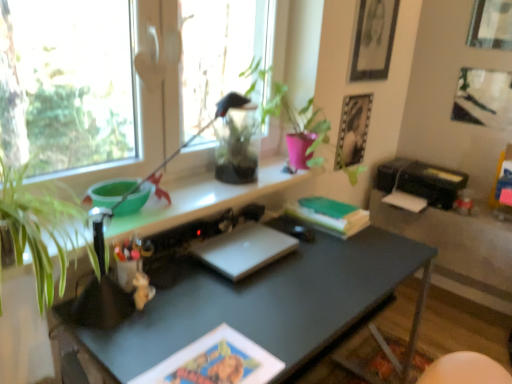
Question: Does metallic silver photo frame at upper right, placed as the 4th picture frame when sorted from right to left, turn towards matte black picture frame at upper right, acting as the 2th picture frame starting from the left?

Choices:
 (A) no
 (B) yes

Answer: (A)

Question: Is metallic silver photo frame at upper right, placed as the 4th picture frame when sorted from right to left, turned away from matte black picture frame at upper right, acting as the 2th picture frame starting from the left?

Choices:
 (A) yes
 (B) no

Answer: (B)

Question: From the image's perspective, is metallic silver photo frame at upper right, positioned as the first picture frame in left-to-right order, beneath matte black picture frame at upper right, which ranks as the third picture frame in right-to-left order?

Choices:
 (A) no
 (B) yes

Answer: (B)

Question: Does metallic silver photo frame at upper right, positioned as the first picture frame in left-to-right order, come behind matte black picture frame at upper right, acting as the 2th picture frame starting from the left?

Choices:
 (A) no
 (B) yes

Answer: (B)

Question: Considering the relative sizes of metallic silver photo frame at upper right, positioned as the first picture frame in left-to-right order, and matte black picture frame at upper right, acting as the 2th picture frame starting from the left, in the image provided, is metallic silver photo frame at upper right, positioned as the first picture frame in left-to-right order, smaller than matte black picture frame at upper right, acting as the 2th picture frame starting from the left,?

Choices:
 (A) no
 (B) yes

Answer: (B)

Question: From a real-world perspective, is green matte book at center above or below sleek silver laptop at center?

Choices:
 (A) below
 (B) above

Answer: (B)

Question: Is green matte book at center inside or outside of sleek silver laptop at center?

Choices:
 (A) inside
 (B) outside

Answer: (B)

Question: From the image's perspective, is green matte book at center positioned above or below sleek silver laptop at center?

Choices:
 (A) below
 (B) above

Answer: (B)

Question: Does point (325, 200) appear closer or farther from the camera than point (207, 253)?

Choices:
 (A) closer
 (B) farther

Answer: (B)

Question: Based on their sizes in the image, would you say transparent glass vase at upper center is bigger or smaller than green matte plant at upper center?

Choices:
 (A) small
 (B) big

Answer: (A)

Question: Is point (222, 144) closer or farther from the camera than point (291, 109)?

Choices:
 (A) farther
 (B) closer

Answer: (B)

Question: From a real-world perspective, is transparent glass vase at upper center above or below green matte plant at upper center?

Choices:
 (A) below
 (B) above

Answer: (A)

Question: Considering their positions, is transparent glass vase at upper center located in front of or behind green matte plant at upper center?

Choices:
 (A) behind
 (B) front

Answer: (A)

Question: Is metallic silver photo frame at upper right, positioned as the first picture frame in left-to-right order, inside or outside of transparent glass vase at upper center?

Choices:
 (A) inside
 (B) outside

Answer: (B)

Question: Relative to transparent glass vase at upper center, is metallic silver photo frame at upper right, placed as the 4th picture frame when sorted from right to left, in front or behind?

Choices:
 (A) behind
 (B) front

Answer: (A)